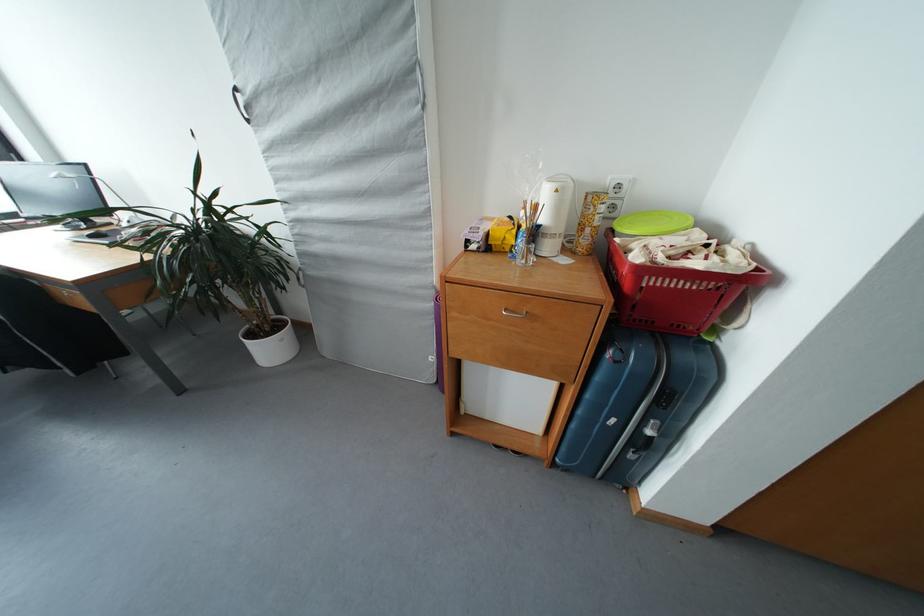
Where would you press the kettle power button? Please return your answer as a coordinate pair (x, y).

(614, 352)